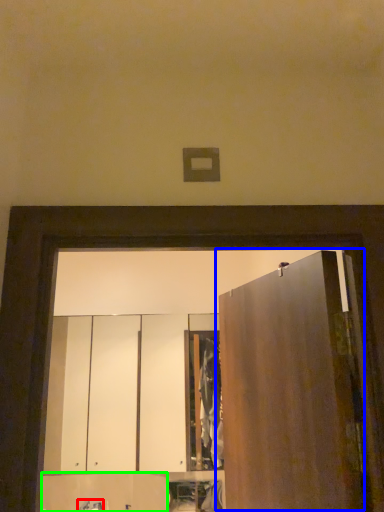
Question: Based on their relative distances, which object is nearer to faucet (highlighted by a red box)? Choose from door (highlighted by a blue box) and cabinetry (highlighted by a green box).

Choices:
 (A) door
 (B) cabinetry

Answer: (B)